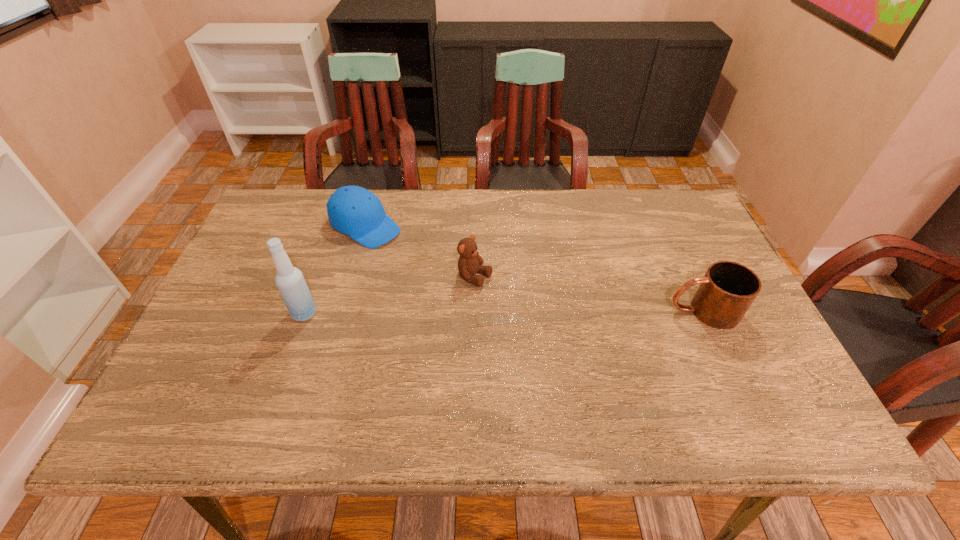
Locate an element on the screen. The height and width of the screenshot is (540, 960). free spot that satisfies the following two spatial constraints: 1. on the front side of the cap; 2. on the side of the mug with the handle is located at coordinates (342, 311).